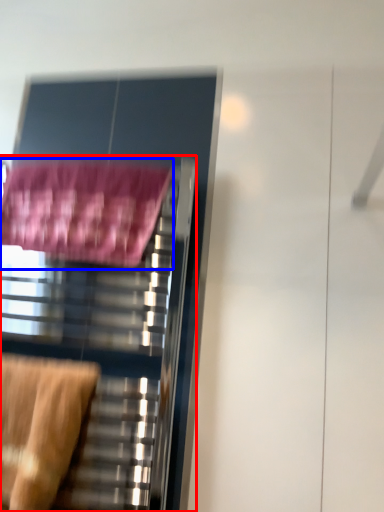
Question: Among these objects, which one is nearest to the camera, furniture (highlighted by a red box) or bath towel (highlighted by a blue box)?

Choices:
 (A) furniture
 (B) bath towel

Answer: (A)